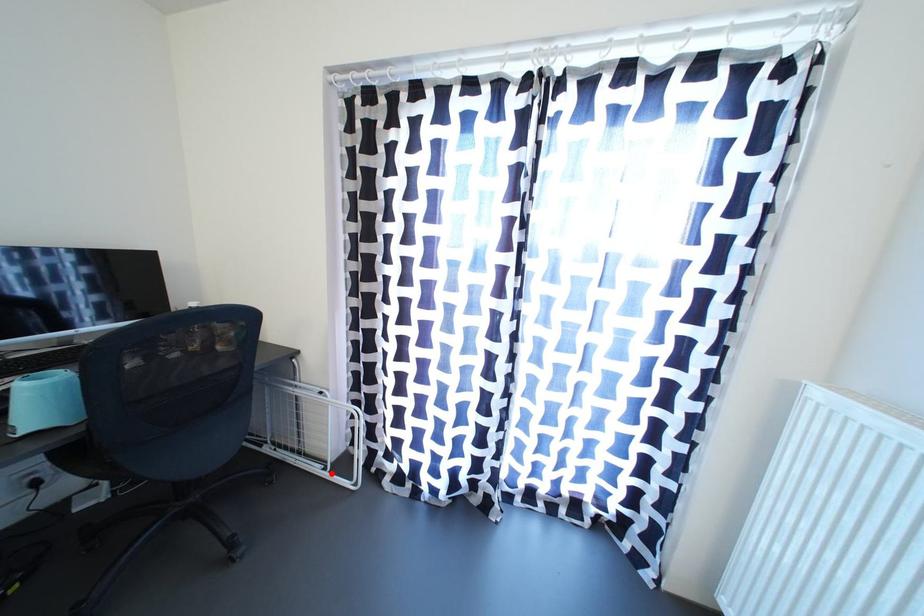
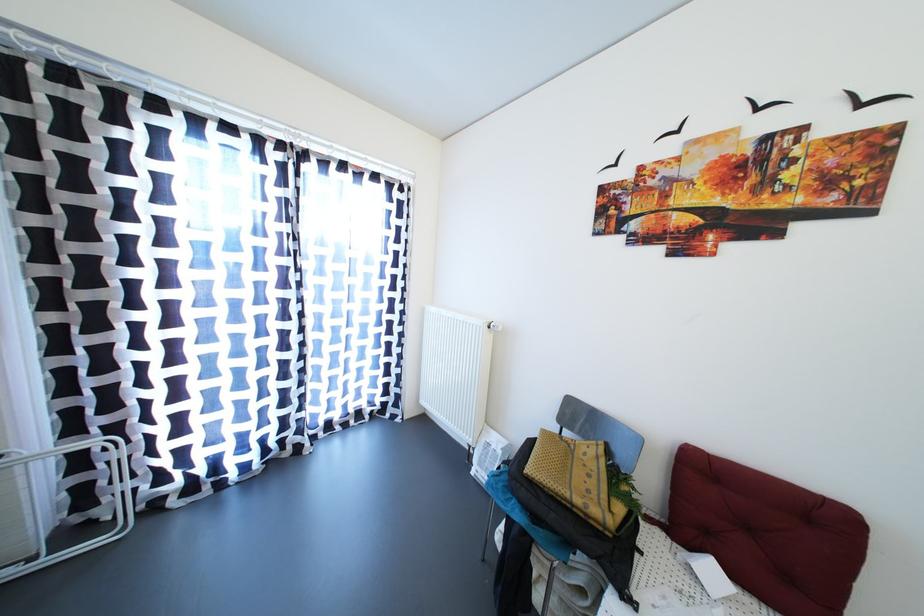
Question: I am providing you with two images of the same scene from different viewpoints. Given a red point in image1, look at the same physical point in image2. Is it:

Choices:
 (A) Closer to the viewpoint
 (B) Farther from the viewpoint

Answer: (A)